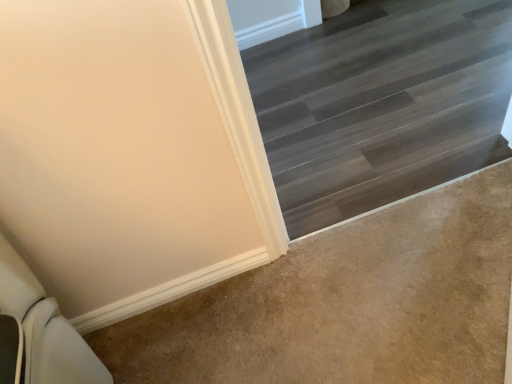
I want to click on beige carpet at lower right, so (347, 304).

Image resolution: width=512 pixels, height=384 pixels. Describe the element at coordinates (347, 304) in the screenshot. I see `beige carpet at lower right` at that location.

The image size is (512, 384). What do you see at coordinates (381, 104) in the screenshot?
I see `dark wood stairs at upper right` at bounding box center [381, 104].

I want to click on dark wood stairs at upper right, so click(381, 104).

Where is `beige carpet at lower right`? This screenshot has height=384, width=512. beige carpet at lower right is located at coordinates (347, 304).

Is dark wood stairs at upper right to the right of beige carpet at lower right from the viewer's perspective?

Yes, dark wood stairs at upper right is to the right of beige carpet at lower right.

Considering the relative positions of dark wood stairs at upper right and beige carpet at lower right in the image provided, is dark wood stairs at upper right behind beige carpet at lower right?

Yes, dark wood stairs at upper right is further from the camera.

Considering the positions of point (400, 195) and point (423, 369), is point (400, 195) closer or farther from the camera than point (423, 369)?

Point (400, 195) appears to be farther away from the viewer than point (423, 369).

From the image's perspective, is dark wood stairs at upper right on top of beige carpet at lower right?

Yes, from the image's perspective, dark wood stairs at upper right is on top of beige carpet at lower right.

From a real-world perspective, is dark wood stairs at upper right beneath beige carpet at lower right?

Correct, in the physical world, dark wood stairs at upper right is lower than beige carpet at lower right.

Consider the image. Which object is thinner, dark wood stairs at upper right or beige carpet at lower right?

Thinner between the two is beige carpet at lower right.

Looking at this image, is dark wood stairs at upper right taller or shorter than beige carpet at lower right?

In the image, dark wood stairs at upper right appears to be taller than beige carpet at lower right.

Is dark wood stairs at upper right bigger than beige carpet at lower right?

→ Correct, dark wood stairs at upper right is larger in size than beige carpet at lower right.

Is beige carpet at lower right inside dark wood stairs at upper right?

No, beige carpet at lower right is not inside dark wood stairs at upper right.

Is dark wood stairs at upper right directly adjacent to beige carpet at lower right?

No, dark wood stairs at upper right is not in contact with beige carpet at lower right.

Is dark wood stairs at upper right turned away from beige carpet at lower right?

No, dark wood stairs at upper right is not facing away from beige carpet at lower right.

How different are the orientations of dark wood stairs at upper right and beige carpet at lower right in degrees?

They differ by 180 degrees in their facing directions.

You are a GUI agent. You are given a task and a screenshot of the screen. Output one action in this format:
    pyautogui.click(x=<x>, y=<y>)
    Task: Click on the concrete below the dark wood stairs at upper right (from the image's perspective)
    Image resolution: width=512 pixels, height=384 pixels.
    Given the screenshot: What is the action you would take?
    pyautogui.click(x=347, y=304)

Considering the relative positions of beige carpet at lower right and dark wood stairs at upper right in the image provided, is beige carpet at lower right to the right of dark wood stairs at upper right from the viewer's perspective?

No, beige carpet at lower right is not to the right of dark wood stairs at upper right.

Consider the image. In the image, is beige carpet at lower right positioned in front of or behind dark wood stairs at upper right?

Visually, beige carpet at lower right is located in front of dark wood stairs at upper right.

Which is nearer, (227, 310) or (358, 69)?

The point (227, 310) is in front.

From the image's perspective, who appears lower, beige carpet at lower right or dark wood stairs at upper right?

beige carpet at lower right appears lower in the image.

From a real-world perspective, is beige carpet at lower right positioned under dark wood stairs at upper right based on gravity?

No.

Which of these two, beige carpet at lower right or dark wood stairs at upper right, is wider?

Wider between the two is dark wood stairs at upper right.

Considering the sizes of objects beige carpet at lower right and dark wood stairs at upper right in the image provided, who is taller, beige carpet at lower right or dark wood stairs at upper right?

dark wood stairs at upper right.

In terms of size, does beige carpet at lower right appear bigger or smaller than dark wood stairs at upper right?

Considering their sizes, beige carpet at lower right takes up less space than dark wood stairs at upper right.

Can we say beige carpet at lower right lies outside dark wood stairs at upper right?

Yes.

Would you say beige carpet at lower right is a long distance from dark wood stairs at upper right?

They are positioned close to each other.

Does beige carpet at lower right turn towards dark wood stairs at upper right?

Yes, beige carpet at lower right is facing dark wood stairs at upper right.

Looking at this image, how different are the orientations of beige carpet at lower right and dark wood stairs at upper right in degrees?

180 degrees.

This screenshot has height=384, width=512. Identify the location of concrete that is below the dark wood stairs at upper right (from the image's perspective). (347, 304).

The width and height of the screenshot is (512, 384). I want to click on concrete in front of the dark wood stairs at upper right, so click(x=347, y=304).

This screenshot has width=512, height=384. I want to click on concrete below the dark wood stairs at upper right (from the image's perspective), so click(x=347, y=304).